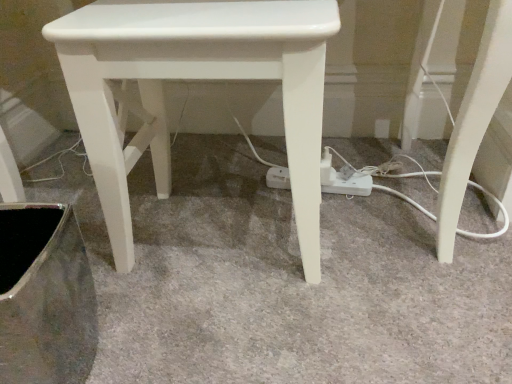
Question: Does white glossy stool at center have a lesser width compared to white plastic extension cord at center?

Choices:
 (A) no
 (B) yes

Answer: (A)

Question: Is the depth of white glossy stool at center less than that of white plastic extension cord at center?

Choices:
 (A) yes
 (B) no

Answer: (A)

Question: Is the surface of white glossy stool at center in direct contact with white plastic extension cord at center?

Choices:
 (A) no
 (B) yes

Answer: (A)

Question: Does white glossy stool at center turn towards white plastic extension cord at center?

Choices:
 (A) yes
 (B) no

Answer: (B)

Question: From a real-world perspective, is white glossy stool at center over white plastic extension cord at center?

Choices:
 (A) no
 (B) yes

Answer: (B)

Question: In terms of height, does metallic silver swivel chair at lower left look taller or shorter compared to white glossy stool at center?

Choices:
 (A) tall
 (B) short

Answer: (B)

Question: From the image's perspective, is metallic silver swivel chair at lower left positioned above or below white glossy stool at center?

Choices:
 (A) above
 (B) below

Answer: (B)

Question: In the image, is metallic silver swivel chair at lower left positioned in front of or behind white glossy stool at center?

Choices:
 (A) behind
 (B) front

Answer: (B)

Question: Based on their positions, is metallic silver swivel chair at lower left located to the left or right of white glossy stool at center?

Choices:
 (A) right
 (B) left

Answer: (B)

Question: Choose the correct answer: Is metallic silver swivel chair at lower left inside white plastic extension cord at center or outside it?

Choices:
 (A) outside
 (B) inside

Answer: (A)

Question: From a real-world perspective, is metallic silver swivel chair at lower left positioned above or below white plastic extension cord at center?

Choices:
 (A) below
 (B) above

Answer: (B)

Question: Is metallic silver swivel chair at lower left in front of or behind white plastic extension cord at center in the image?

Choices:
 (A) behind
 (B) front

Answer: (B)

Question: Considering the positions of metallic silver swivel chair at lower left and white plastic extension cord at center in the image, is metallic silver swivel chair at lower left wider or thinner than white plastic extension cord at center?

Choices:
 (A) wide
 (B) thin

Answer: (A)

Question: Is white plastic extension cord at center taller or shorter than metallic silver swivel chair at lower left?

Choices:
 (A) tall
 (B) short

Answer: (B)

Question: Based on their sizes in the image, would you say white plastic extension cord at center is bigger or smaller than metallic silver swivel chair at lower left?

Choices:
 (A) big
 (B) small

Answer: (B)